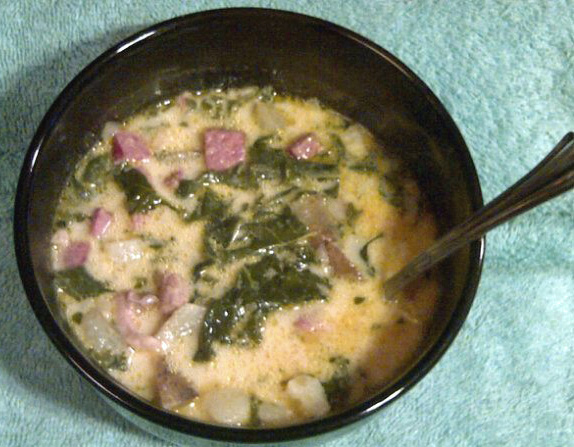
Where is `bowl`? bowl is located at coordinates (259, 38).